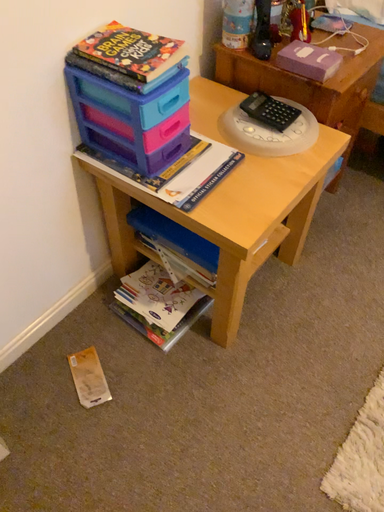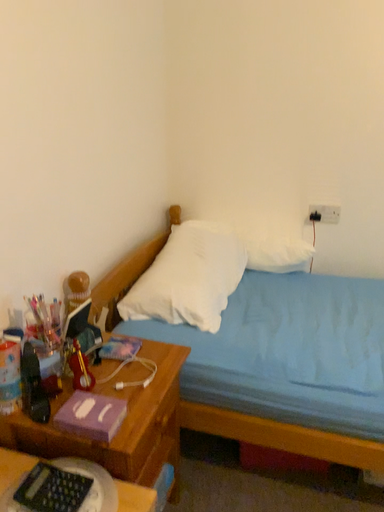
Question: How did the camera likely rotate when shooting the video?

Choices:
 (A) rotated upward
 (B) rotated downward

Answer: (A)